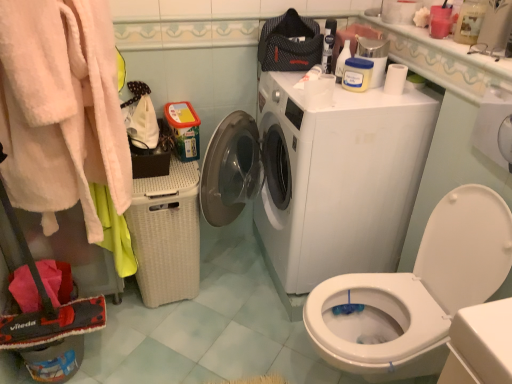
Question: Is white glossy washing machine at center thinner than matte white jar at upper center?

Choices:
 (A) no
 (B) yes

Answer: (A)

Question: Is white glossy washing machine at center at the left side of matte white jar at upper center?

Choices:
 (A) yes
 (B) no

Answer: (A)

Question: Is white glossy washing machine at center in front of matte white jar at upper center?

Choices:
 (A) yes
 (B) no

Answer: (A)

Question: Is white glossy washing machine at center smaller than matte white jar at upper center?

Choices:
 (A) yes
 (B) no

Answer: (B)

Question: Considering the relative positions of white glossy washing machine at center and matte white jar at upper center in the image provided, is white glossy washing machine at center to the right of matte white jar at upper center from the viewer's perspective?

Choices:
 (A) no
 (B) yes

Answer: (A)

Question: From a real-world perspective, is white glossy washing machine at center below matte white jar at upper center?

Choices:
 (A) no
 (B) yes

Answer: (B)

Question: Does white glossy countertop at upper right lie in front of fluffy pink bathrobe at left?

Choices:
 (A) yes
 (B) no

Answer: (B)

Question: Is white glossy countertop at upper right completely or partially outside of fluffy pink bathrobe at left?

Choices:
 (A) yes
 (B) no

Answer: (A)

Question: From a real-world perspective, is white glossy countertop at upper right under fluffy pink bathrobe at left?

Choices:
 (A) yes
 (B) no

Answer: (B)

Question: Is white glossy countertop at upper right bigger than fluffy pink bathrobe at left?

Choices:
 (A) yes
 (B) no

Answer: (B)

Question: Could you tell me if white glossy countertop at upper right is turned towards fluffy pink bathrobe at left?

Choices:
 (A) yes
 (B) no

Answer: (A)

Question: From the image's perspective, would you say white glossy countertop at upper right is positioned over fluffy pink bathrobe at left?

Choices:
 (A) no
 (B) yes

Answer: (B)

Question: Is there a large distance between white glossy countertop at upper right and white wicker laundry basket at left?

Choices:
 (A) yes
 (B) no

Answer: (A)